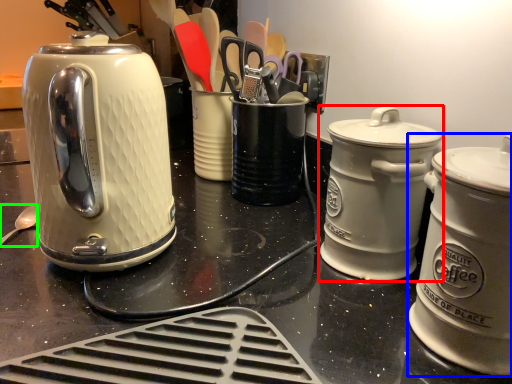
Question: Which is farther away from kitchen appliance (highlighted by a red box)? kitchen appliance (highlighted by a blue box) or spoon (highlighted by a green box)?

Choices:
 (A) kitchen appliance
 (B) spoon

Answer: (B)